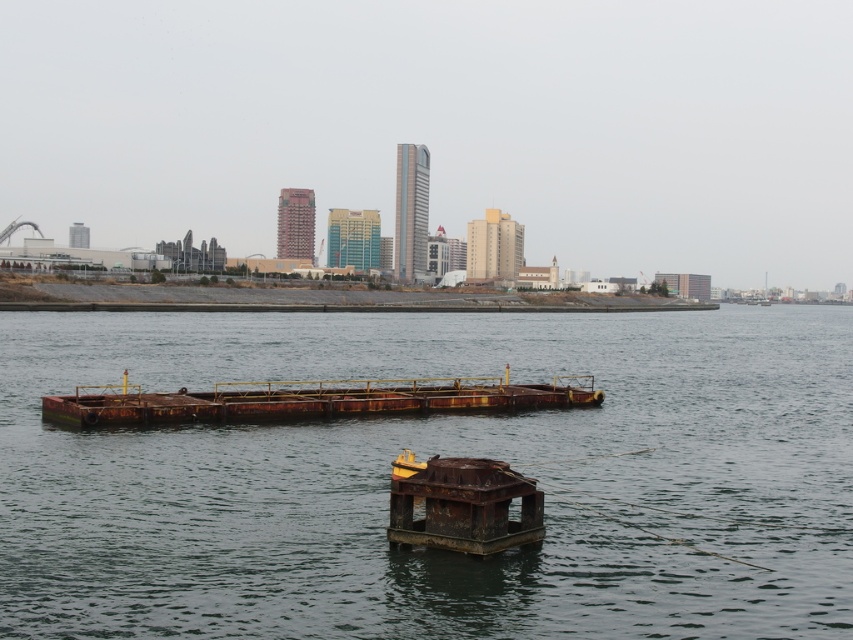
Question: Where is rusty metal water at center located in relation to rusty metal barge at center in the image?

Choices:
 (A) right
 (B) left

Answer: (A)

Question: Among these points, which one is farthest from the camera?

Choices:
 (A) (306, 403)
 (B) (512, 486)

Answer: (A)

Question: Which point is farther to the camera?

Choices:
 (A) rusty metal barge at center
 (B) rusty metal water at center

Answer: (A)

Question: From the image, what is the correct spatial relationship of rusty metal water at center in relation to rusty metal barge at center?

Choices:
 (A) above
 (B) below

Answer: (A)

Question: Which is farther from the rusty metal water at center?

Choices:
 (A) rusty metal barge at center
 (B) rusty metal dock at center

Answer: (B)

Question: Is rusty metal water at center smaller than rusty metal barge at center?

Choices:
 (A) no
 (B) yes

Answer: (A)